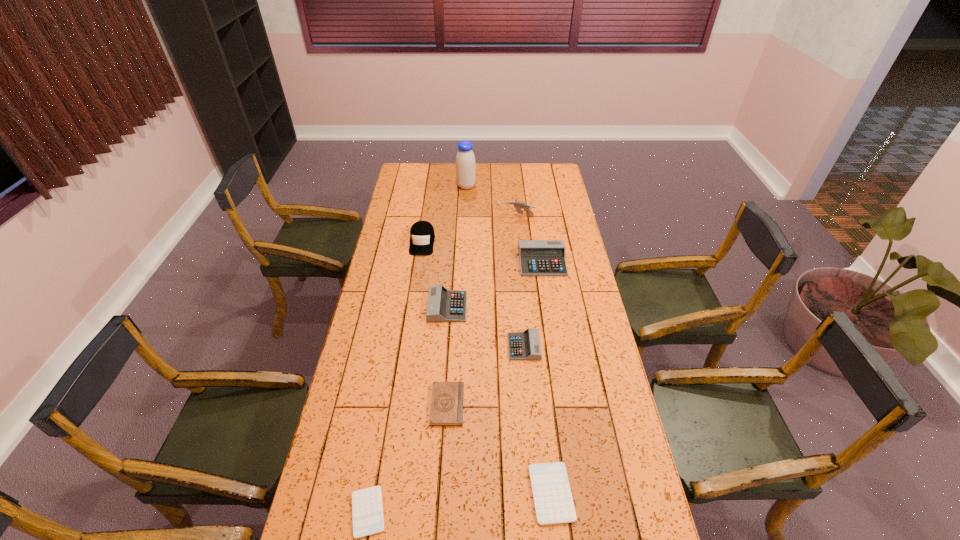
This screenshot has height=540, width=960. What are the coordinates of `object situated at the right edge` in the screenshot? It's located at (537, 257).

In the image, there is a desktop. At what (x,y) coordinates should I click in order to perform the action: click on vacant space at the far edge. Please return your answer as a coordinate pair (x, y). The height and width of the screenshot is (540, 960). Looking at the image, I should click on (451, 168).

What are the coordinates of `vacant space at the left edge` in the screenshot? It's located at (411, 199).

Find the location of `vacant region at the far left corner of the desktop`. vacant region at the far left corner of the desktop is located at coordinates (420, 170).

The width and height of the screenshot is (960, 540). Identify the location of free space between the nearest gray calculator and the eighth tallest object. (538, 420).

This screenshot has height=540, width=960. I want to click on vacant point located between the farthest gray calculator and the eighth nearest object, so coord(529,239).

What are the coordinates of `empty space that is in between the seventh farthest object and the leftmost gray calculator` in the screenshot? It's located at (447, 356).

At what (x,y) coordinates should I click in order to perform the action: click on vacant region between the gun and the cap. Please return your answer as a coordinate pair (x, y). The width and height of the screenshot is (960, 540). Looking at the image, I should click on (468, 230).

The height and width of the screenshot is (540, 960). In order to click on empty location between the eighth tallest object and the tallest calculator in this screenshot , I will do pos(547,377).

You are a GUI agent. You are given a task and a screenshot of the screen. Output one action in this format:
    pyautogui.click(x=<x>, y=<y>)
    Task: Click on the vacant space that is in between the black cap and the gun
    The image size is (960, 540).
    Given the screenshot: What is the action you would take?
    pyautogui.click(x=468, y=230)